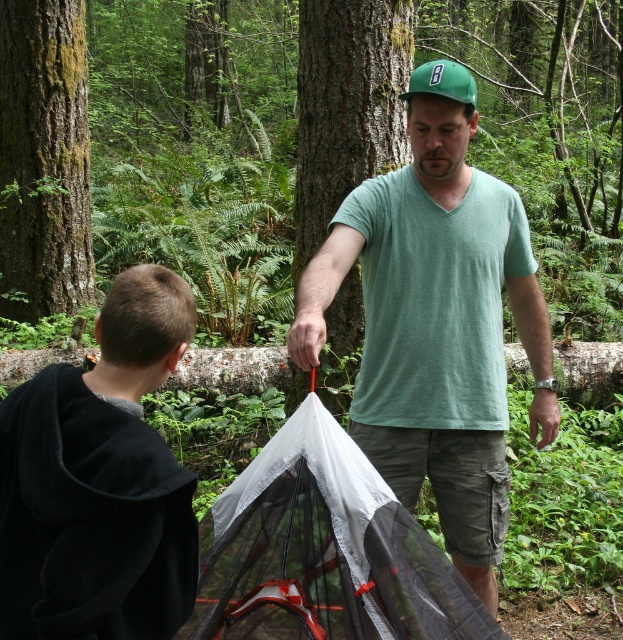
Question: From the image, what is the correct spatial relationship of black fleece hoodie at lower left in relation to transparent mesh tent at center?

Choices:
 (A) left
 (B) right

Answer: (A)

Question: Which of the following is the farthest from the observer?

Choices:
 (A) green matte baseball cap at center
 (B) green matte t-shirt at center

Answer: (A)

Question: Is black fleece hoodie at lower left to the left of transparent mesh tent at center from the viewer's perspective?

Choices:
 (A) yes
 (B) no

Answer: (A)

Question: Which of the following is the closest to the observer?

Choices:
 (A) green matte t-shirt at center
 (B) black fleece hoodie at lower left
 (C) green matte baseball cap at center
 (D) transparent mesh tent at center

Answer: (B)

Question: Can you confirm if green matte t-shirt at center is smaller than green matte baseball cap at center?

Choices:
 (A) no
 (B) yes

Answer: (A)

Question: Which point appears farthest from the camera in this image?

Choices:
 (A) (x=287, y=595)
 (B) (x=437, y=61)
 (C) (x=340, y=220)

Answer: (C)